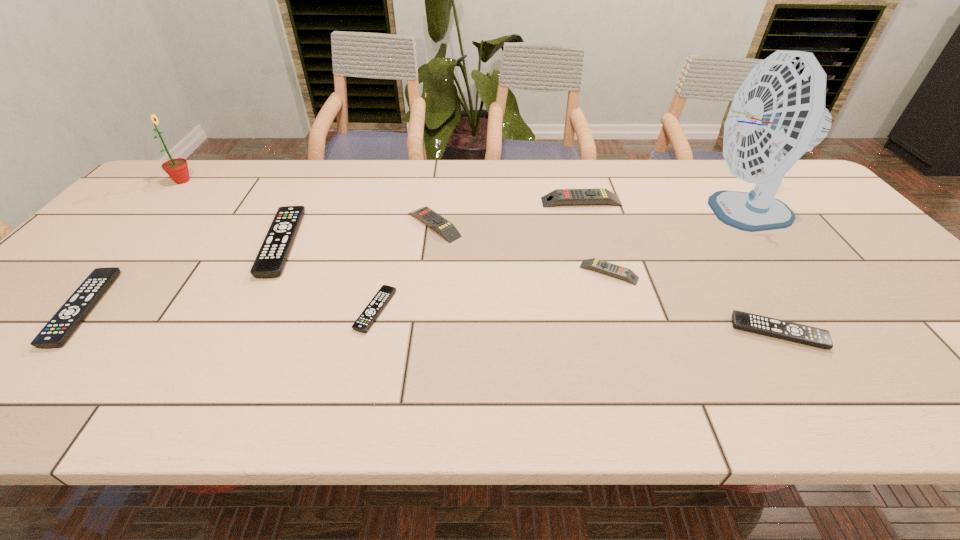
The width and height of the screenshot is (960, 540). What are the coordinates of `vacant space located on the back of the farthest yellow remote control` in the screenshot? It's located at (568, 160).

Where is `vacant space located 0.150m on the left of the sixth remote control from right to left`? This screenshot has height=540, width=960. vacant space located 0.150m on the left of the sixth remote control from right to left is located at coordinates (209, 244).

Locate an element on the screen. vacant area situated on the back of the leftmost yellow remote control is located at coordinates (441, 171).

Image resolution: width=960 pixels, height=540 pixels. Identify the location of free space located on the back of the leftmost black remote control. (188, 192).

Where is `free space located 0.260m on the back of the smallest yellow remote control`? free space located 0.260m on the back of the smallest yellow remote control is located at coordinates (588, 204).

The image size is (960, 540). I want to click on vacant space located 0.130m on the right of the rightmost remote control, so click(x=881, y=333).

Locate an element on the screen. This screenshot has height=540, width=960. free space located on the back of the shortest object is located at coordinates coord(401,201).

Identify the location of fan that is at the far edge. coord(778,113).

Image resolution: width=960 pixels, height=540 pixels. I want to click on sunflower that is at the far edge, so click(x=177, y=169).

In order to click on remote control present at the far edge in this screenshot , I will do `click(599, 195)`.